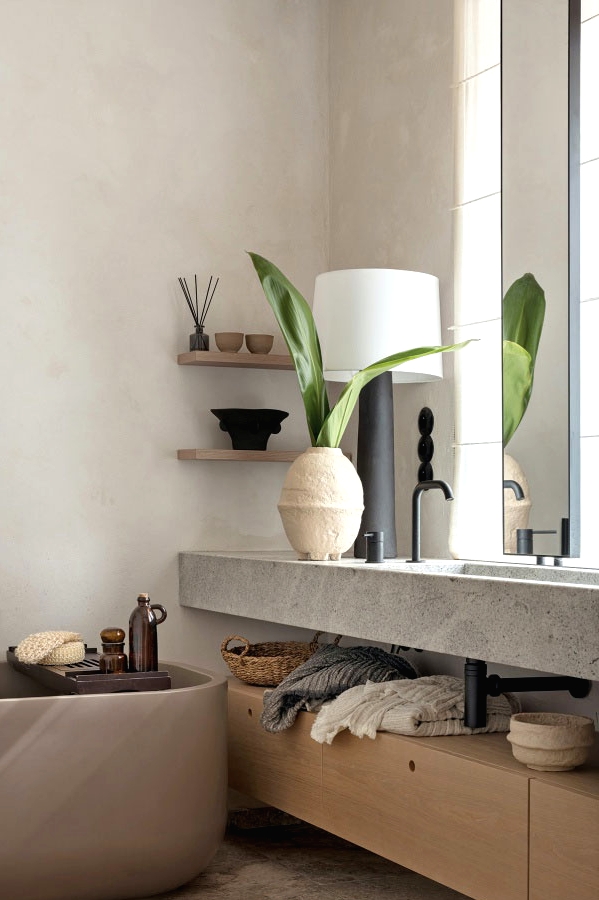
This screenshot has height=900, width=599. Identify the location of lamp base. (382, 459).